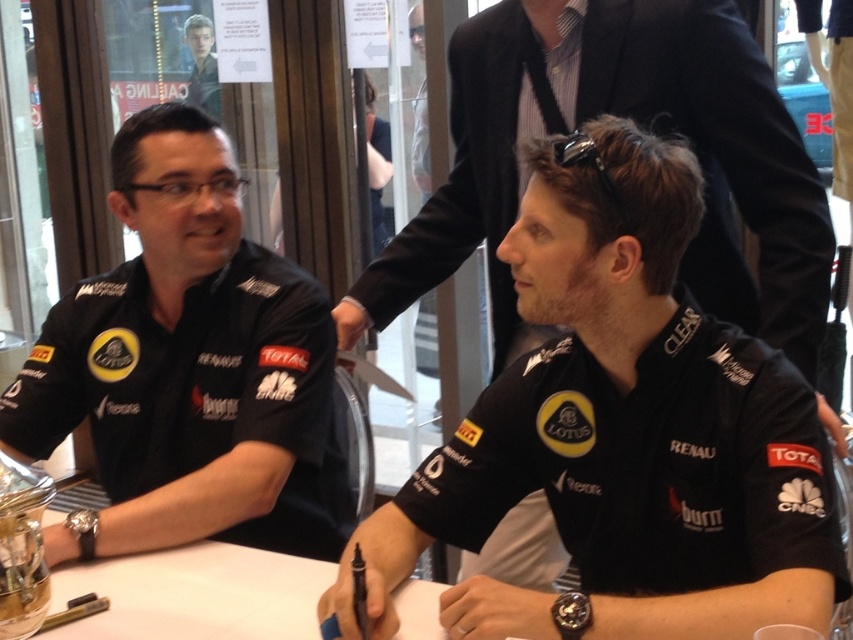
Question: Is black matte shirt at center positioned before white glossy table at center?

Choices:
 (A) yes
 (B) no

Answer: (A)

Question: Considering the relative positions of black matte shirt at center and white glossy table at center in the image provided, where is black matte shirt at center located with respect to white glossy table at center?

Choices:
 (A) below
 (B) above

Answer: (B)

Question: Is black matte shirt at center positioned behind black matte shirt at left?

Choices:
 (A) yes
 (B) no

Answer: (B)

Question: Which point is farther from the camera taking this photo?

Choices:
 (A) (207, 564)
 (B) (292, 380)
 (C) (524, 636)

Answer: (B)

Question: Among these objects, which one is nearest to the camera?

Choices:
 (A) white glossy table at center
 (B) black matte shirt at left
 (C) black matte shirt at center

Answer: (C)

Question: Which of the following is the closest to the observer?

Choices:
 (A) (668, 444)
 (B) (164, 627)
 (C) (198, 280)

Answer: (A)